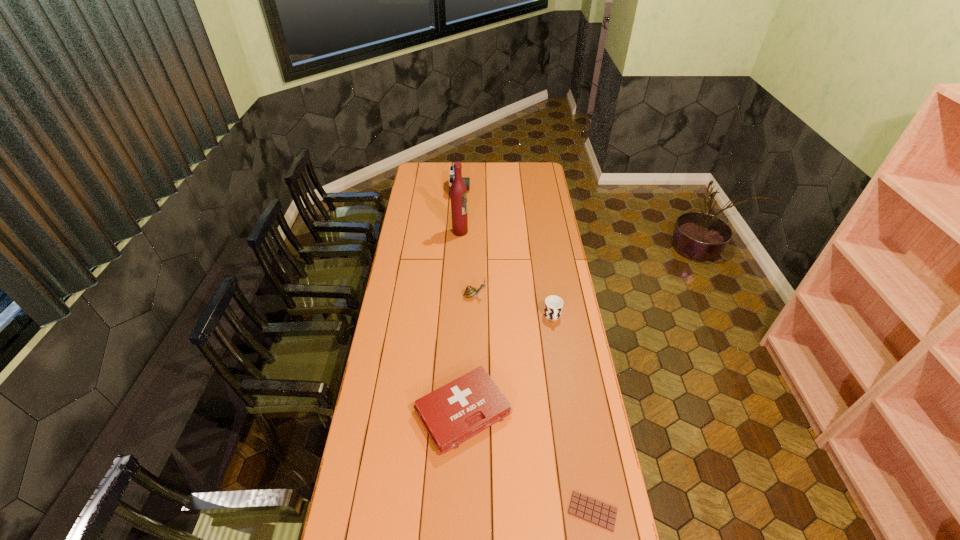
In the image, there is a desktop. Where is `vacant space at the left edge`? vacant space at the left edge is located at coordinates (405, 374).

Find the location of a particular element. The width and height of the screenshot is (960, 540). vacant space at the right edge of the desktop is located at coordinates click(x=578, y=418).

Image resolution: width=960 pixels, height=540 pixels. What are the coordinates of `vacant space in between the tallest object and the nearest object` in the screenshot? It's located at (526, 372).

You are a GUI agent. You are given a task and a screenshot of the screen. Output one action in this format:
    pyautogui.click(x=<x>, y=<y>)
    Task: Click on the free area in between the cup and the shortest object
    The height and width of the screenshot is (540, 960).
    Given the screenshot: What is the action you would take?
    point(572,414)

Where is `free spot between the nearest object and the farthest object`? This screenshot has height=540, width=960. free spot between the nearest object and the farthest object is located at coordinates (526, 350).

Where is `free space between the snail and the camera`? free space between the snail and the camera is located at coordinates (468, 243).

You are a GUI agent. You are given a task and a screenshot of the screen. Output one action in this format:
    pyautogui.click(x=<x>, y=<y>)
    Task: Click on the free space between the nearest object and the fourth farthest object
    This screenshot has height=540, width=960.
    Given the screenshot: What is the action you would take?
    pyautogui.click(x=572, y=414)

Where is `free space that is in between the tallest object and the fourth tallest object`? This screenshot has width=960, height=540. free space that is in between the tallest object and the fourth tallest object is located at coordinates (506, 274).

Where is `unoccupied position between the snail and the candy bar`? The height and width of the screenshot is (540, 960). unoccupied position between the snail and the candy bar is located at coordinates (534, 403).

This screenshot has height=540, width=960. Find the location of `vacant area that lies between the first-aid kit and the shortest object`. vacant area that lies between the first-aid kit and the shortest object is located at coordinates (528, 461).